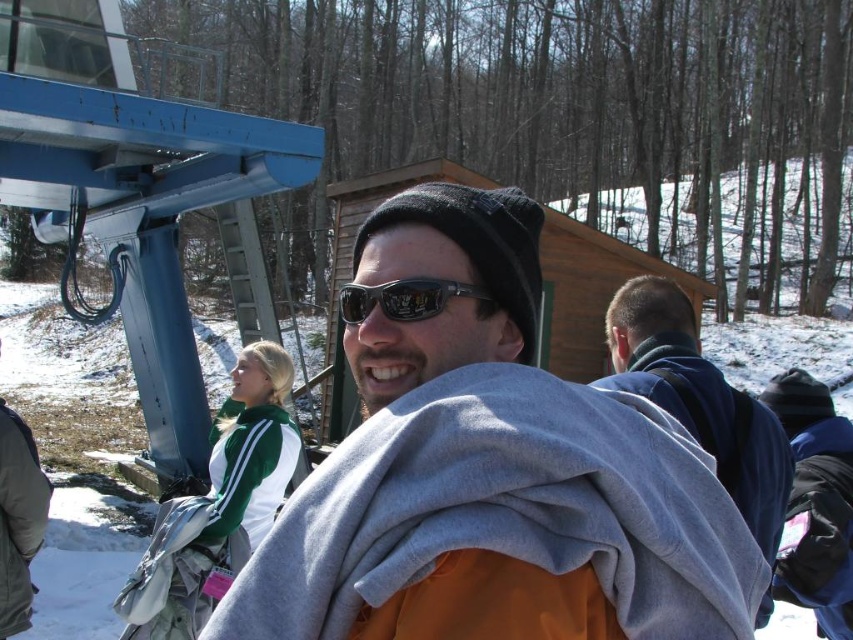
You are a photographer taking a portrait of the man in the scene. You notice the gray fleece scarf at center and the black reflective sunglasses at center. Which object should you adjust to ensure the other is clearly visible in the photo?

The gray fleece scarf at center is in front of the black reflective sunglasses at center. To ensure the sunglasses are visible, you should adjust the scarf so it is no longer blocking them.

You are a delivery drone with a 1.5 meter wingspan. You need to fly between the blue fleece jacket at upper right and the black reflective sunglasses at center. Can you safely pass through the space between them?

The distance between the blue fleece jacket at upper right and the black reflective sunglasses at center is 1.64 meters. Since your wingspan is 1.5 meters, you can safely pass through the space between them as it is wider than your drone.

You are a photographer trying to capture the man in the orange jacket with both the gray fleece scarf at center and the black reflective sunglasses at center in the frame. Since you want to ensure both items are clearly visible, which one should you focus on first to avoid blurring due to their size differences?

The gray fleece scarf at center is taller than the black reflective sunglasses at center, so you should focus on the gray fleece scarf at center first as it is larger and requires more precise focus to ensure clarity.